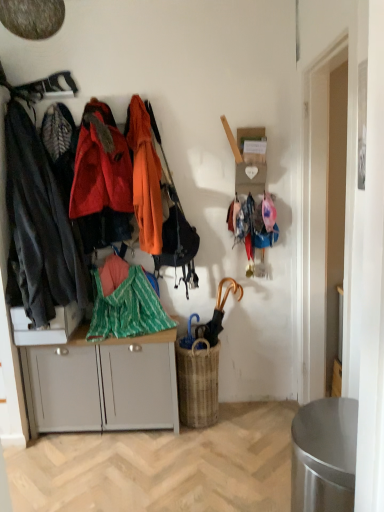
Question: Considering the relative sizes of gold metallic umbrella at center-right and orange matte jacket at left, which appears as the 2th clothing when viewed from the left, in the image provided, is gold metallic umbrella at center-right smaller than orange matte jacket at left, which appears as the 2th clothing when viewed from the left,?

Choices:
 (A) yes
 (B) no

Answer: (A)

Question: Is gold metallic umbrella at center-right wider than orange matte jacket at left, the 2th clothing when ordered from right to left?

Choices:
 (A) no
 (B) yes

Answer: (A)

Question: Does gold metallic umbrella at center-right lie in front of orange matte jacket at left, which appears as the 2th clothing when viewed from the left?

Choices:
 (A) yes
 (B) no

Answer: (B)

Question: From the image's perspective, is gold metallic umbrella at center-right above orange matte jacket at left, which appears as the 2th clothing when viewed from the left?

Choices:
 (A) no
 (B) yes

Answer: (A)

Question: From a real-world perspective, is gold metallic umbrella at center-right on top of orange matte jacket at left, which appears as the 2th clothing when viewed from the left?

Choices:
 (A) no
 (B) yes

Answer: (A)

Question: From the image's perspective, relative to orange matte jacket at left, which appears as the 2th clothing when viewed from the left, is green striped fabric at center above or below?

Choices:
 (A) above
 (B) below

Answer: (B)

Question: In the image, is green striped fabric at center positioned in front of or behind orange matte jacket at left, which appears as the 2th clothing when viewed from the left?

Choices:
 (A) front
 (B) behind

Answer: (B)

Question: In terms of width, does green striped fabric at center look wider or thinner when compared to orange matte jacket at left, the 2th clothing when ordered from right to left?

Choices:
 (A) wide
 (B) thin

Answer: (A)

Question: Considering the positions of point (99, 275) and point (92, 165), is point (99, 275) closer or farther from the camera than point (92, 165)?

Choices:
 (A) closer
 (B) farther

Answer: (B)

Question: Is point (125, 349) positioned closer to the camera than point (218, 287)?

Choices:
 (A) closer
 (B) farther

Answer: (A)

Question: Considering their positions, is white matte cabinet at center located in front of or behind gold metallic umbrella at center-right?

Choices:
 (A) behind
 (B) front

Answer: (B)

Question: Based on their positions, is white matte cabinet at center located to the left or right of gold metallic umbrella at center-right?

Choices:
 (A) right
 (B) left

Answer: (B)

Question: From a real-world perspective, relative to gold metallic umbrella at center-right, is white matte cabinet at center vertically above or below?

Choices:
 (A) above
 (B) below

Answer: (B)

Question: From a real-world perspective, relative to white matte cabinet at center, is gold metallic umbrella at center-right vertically above or below?

Choices:
 (A) above
 (B) below

Answer: (A)

Question: Is gold metallic umbrella at center-right bigger or smaller than white matte cabinet at center?

Choices:
 (A) big
 (B) small

Answer: (B)